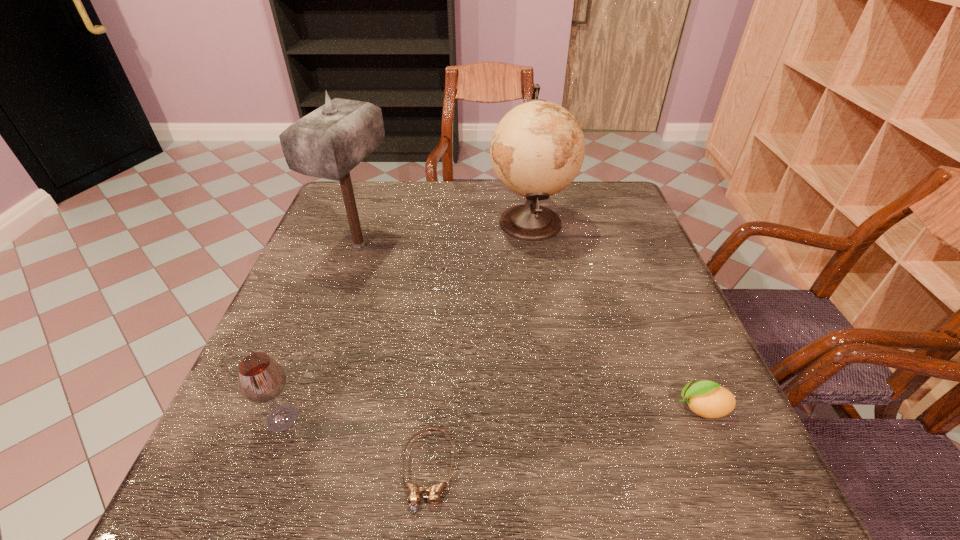
I want to click on free spot at the near right corner of the desktop, so click(x=754, y=494).

Identify the location of free space between the wineglass and the lemon. The width and height of the screenshot is (960, 540). (492, 413).

You are a GUI agent. You are given a task and a screenshot of the screen. Output one action in this format:
    pyautogui.click(x=<x>, y=<y>)
    Task: Click on the vacant area between the mallet and the rightmost object
    
    Given the screenshot: What is the action you would take?
    pyautogui.click(x=531, y=327)

This screenshot has height=540, width=960. I want to click on vacant area that lies between the fourth object from left to right and the wineglass, so click(x=406, y=320).

You are a GUI agent. You are given a task and a screenshot of the screen. Output one action in this format:
    pyautogui.click(x=<x>, y=<y>)
    Task: Click on the free space between the lemon and the globe
    This screenshot has height=540, width=960.
    Given the screenshot: What is the action you would take?
    pyautogui.click(x=615, y=315)

The image size is (960, 540). I want to click on empty space between the fourth object from left to right and the third shortest object, so click(406, 320).

I want to click on empty location between the lemon and the fourth object from left to right, so click(x=615, y=315).

At what (x,y) coordinates should I click in order to perform the action: click on vacant space that's between the lemon and the third object from left to right. Please return your answer as a coordinate pair (x, y). Image resolution: width=960 pixels, height=540 pixels. Looking at the image, I should click on (564, 440).

This screenshot has width=960, height=540. Find the location of `free spot between the third shortest object and the mallet`. free spot between the third shortest object and the mallet is located at coordinates (321, 332).

Locate an element on the screen. This screenshot has height=540, width=960. free space between the fourth tallest object and the fourth object from left to right is located at coordinates (615, 315).